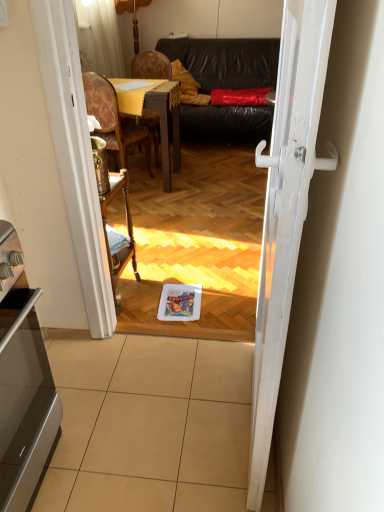
Question: Considering the relative positions of satin silver oven at lower left and woodenchair at center, marked as the 2th chair in a back-to-front arrangement, in the image provided, is satin silver oven at lower left in front of woodenchair at center, marked as the 2th chair in a back-to-front arrangement,?

Choices:
 (A) no
 (B) yes

Answer: (B)

Question: Is woodenchair at center, marked as the 2th chair in a back-to-front arrangement, a part of satin silver oven at lower left?

Choices:
 (A) yes
 (B) no

Answer: (B)

Question: Is satin silver oven at lower left turned away from woodenchair at center, marked as the 2th chair in a back-to-front arrangement?

Choices:
 (A) no
 (B) yes

Answer: (A)

Question: Does satin silver oven at lower left appear on the right side of woodenchair at center, marked as the 2th chair in a back-to-front arrangement?

Choices:
 (A) no
 (B) yes

Answer: (B)

Question: Can you confirm if satin silver oven at lower left is shorter than woodenchair at center, placed as the 1th chair when sorted from front to back?

Choices:
 (A) yes
 (B) no

Answer: (A)

Question: Would you consider satin silver oven at lower left to be distant from woodenchair at center, placed as the 1th chair when sorted from front to back?

Choices:
 (A) no
 (B) yes

Answer: (B)

Question: Are white glossy door at center and satin silver oven at lower left beside each other?

Choices:
 (A) yes
 (B) no

Answer: (B)

Question: From the image's perspective, does white glossy door at center appear higher than satin silver oven at lower left?

Choices:
 (A) no
 (B) yes

Answer: (B)

Question: Is white glossy door at center turned away from satin silver oven at lower left?

Choices:
 (A) no
 (B) yes

Answer: (A)

Question: Does white glossy door at center have a lesser width compared to satin silver oven at lower left?

Choices:
 (A) no
 (B) yes

Answer: (B)

Question: Can you confirm if white glossy door at center is positioned to the left of satin silver oven at lower left?

Choices:
 (A) yes
 (B) no

Answer: (B)

Question: From the image's perspective, is white glossy door at center under satin silver oven at lower left?

Choices:
 (A) yes
 (B) no

Answer: (B)

Question: Considering the relative positions of beige tile at lower center and leather couch at center in the image provided, is beige tile at lower center behind leather couch at center?

Choices:
 (A) no
 (B) yes

Answer: (A)